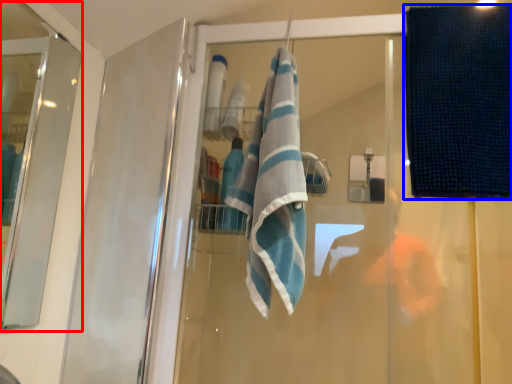
Question: Among these objects, which one is nearest to the camera, screen door (highlighted by a red box) or beach towel (highlighted by a blue box)?

Choices:
 (A) screen door
 (B) beach towel

Answer: (A)